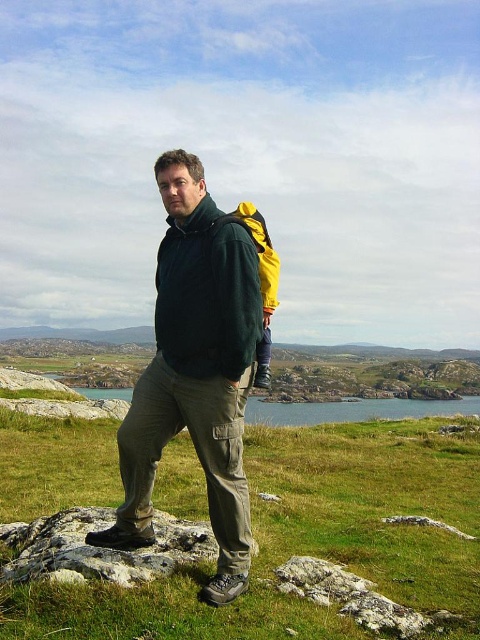
You are a hiker trying to locate your gear. You see a matte green jacket at center and a green matte jacket at center. Which one is positioned lower?

The matte green jacket at center is positioned lower than the green matte jacket at center.

You are a hiker trying to locate your gear. You see the green matte jacket at center. Where exactly is it positioned in the image?

The green matte jacket at center is located at point 0.463 on the horizontal axis and 0.433 on the vertical axis.